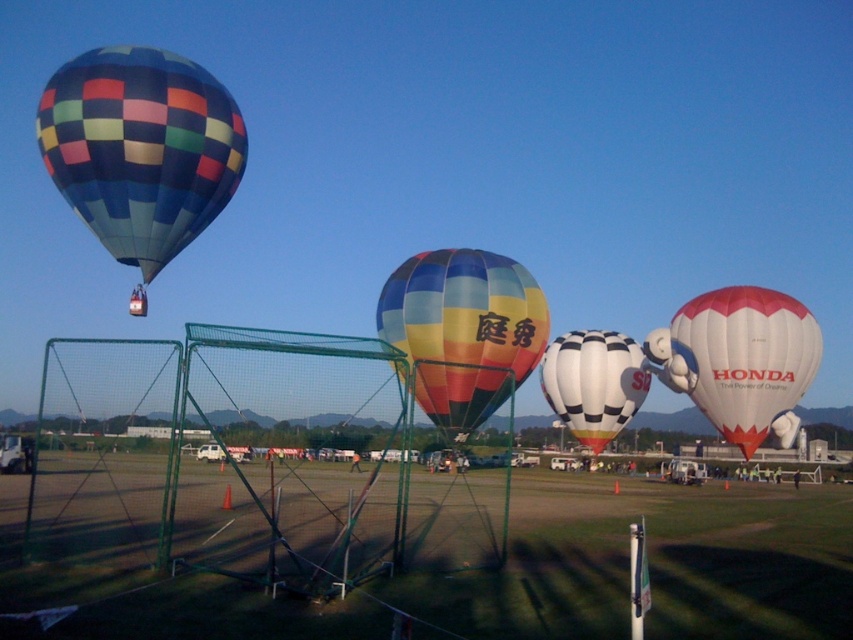
In the scene shown: Does green grass at center have a greater height compared to rainbow fabric hot air balloon at center?

Correct, green grass at center is much taller as rainbow fabric hot air balloon at center.

Identify the location of green grass at center. The image size is (853, 640). (653, 563).

This screenshot has width=853, height=640. What are the coordinates of `green grass at center` in the screenshot? It's located at (653, 563).

I want to click on green grass at center, so click(653, 563).

Between point (431, 346) and point (567, 397), which one is positioned in front?

Point (431, 346) is more forward.

The width and height of the screenshot is (853, 640). What do you see at coordinates (463, 330) in the screenshot?
I see `rainbow fabric hot air balloon at center` at bounding box center [463, 330].

You are a GUI agent. You are given a task and a screenshot of the screen. Output one action in this format:
    pyautogui.click(x=<x>, y=<y>)
    Task: Click on the rainbow fabric hot air balloon at center
    Image resolution: width=853 pixels, height=640 pixels.
    Given the screenshot: What is the action you would take?
    pyautogui.click(x=463, y=330)

Who is taller, checkerboard fabric hot air balloon at left or rainbow fabric hot air balloon at center?

With more height is rainbow fabric hot air balloon at center.

Does point (61, 148) lie in front of point (509, 264)?

Yes, point (61, 148) is in front of point (509, 264).

Where is `checkerboard fabric hot air balloon at left`? Image resolution: width=853 pixels, height=640 pixels. checkerboard fabric hot air balloon at left is located at coordinates (140, 150).